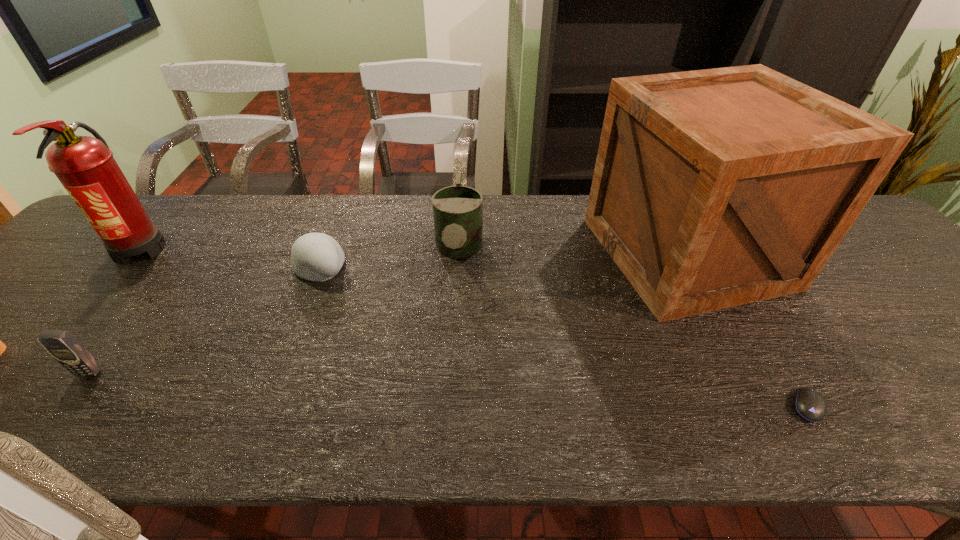
Image resolution: width=960 pixels, height=540 pixels. What are the coordinates of `object present at the left edge` in the screenshot? It's located at (85, 166).

This screenshot has width=960, height=540. I want to click on object present at the far left corner, so click(85, 166).

The image size is (960, 540). I want to click on free space at the far edge of the desktop, so click(x=420, y=233).

At what (x,y) coordinates should I click in order to perform the action: click on vacant space at the near edge of the desktop. Please return your answer as a coordinate pair (x, y). The width and height of the screenshot is (960, 540). Looking at the image, I should click on (400, 414).

I want to click on free space at the left edge of the desktop, so click(x=14, y=332).

Identify the location of free spot at the right edge of the desktop. (894, 285).

You are a GUI agent. You are given a task and a screenshot of the screen. Output one action in this format:
    pyautogui.click(x=<x>, y=<y>)
    Task: Click on the free location at the far left corner
    
    Given the screenshot: What is the action you would take?
    pyautogui.click(x=159, y=201)

Image resolution: width=960 pixels, height=540 pixels. Find the location of `vacant area that lies between the shortest object and the beanie`. vacant area that lies between the shortest object and the beanie is located at coordinates (564, 336).

Identify the location of free point between the fifth farthest object and the beanie. (205, 320).

Where is `empty location between the box and the fourth object from left to right`? This screenshot has height=540, width=960. empty location between the box and the fourth object from left to right is located at coordinates (572, 252).